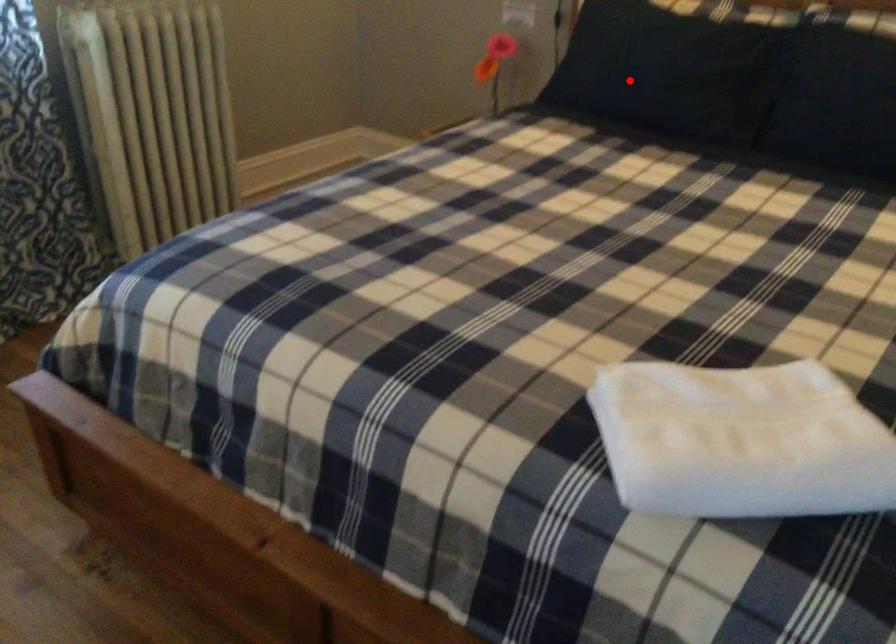
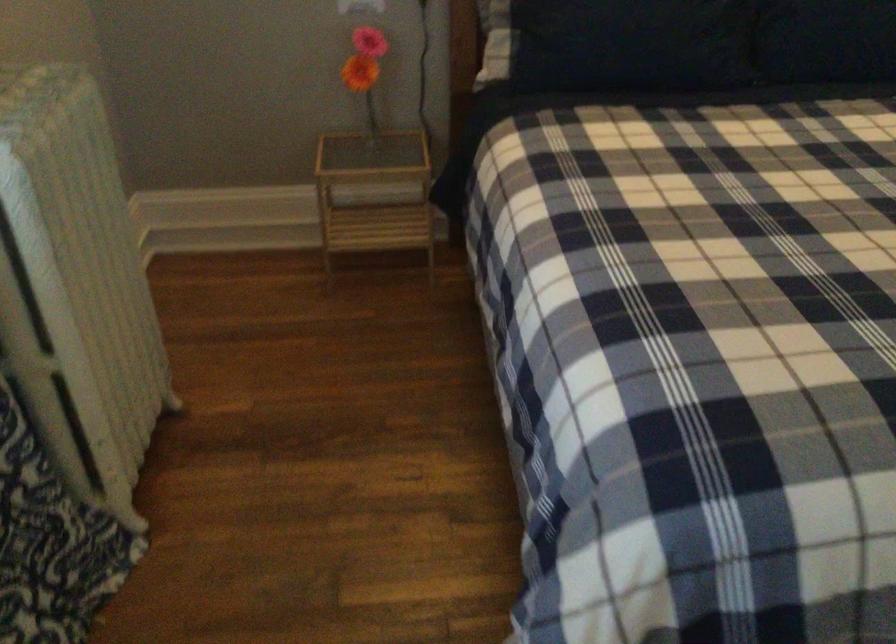
Locate, in the second image, the point that corresponds to the highlighted location in the first image.

(631, 44)